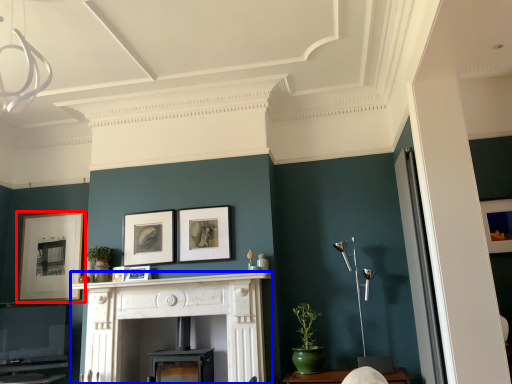
Question: Which object is further to the camera taking this photo, picture frame (highlighted by a red box) or fireplace (highlighted by a blue box)?

Choices:
 (A) picture frame
 (B) fireplace

Answer: (A)